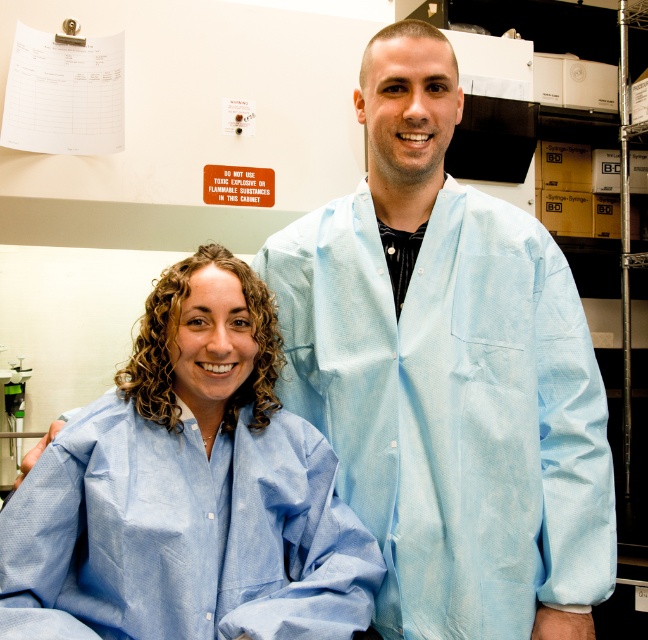
Question: Where is light blue fabric lab coat at center located in relation to light blue fabric at center in the image?

Choices:
 (A) right
 (B) left

Answer: (A)

Question: Can you confirm if light blue fabric lab coat at center is positioned above light blue fabric at center?

Choices:
 (A) no
 (B) yes

Answer: (B)

Question: Among these points, which one is nearest to the camera?

Choices:
 (A) (421, 506)
 (B) (152, 625)

Answer: (B)

Question: Which point is farther from the camera taking this photo?

Choices:
 (A) click(x=229, y=595)
 (B) click(x=550, y=321)

Answer: (B)

Question: Does light blue fabric lab coat at center have a greater width compared to light blue fabric at center?

Choices:
 (A) yes
 (B) no

Answer: (A)

Question: Which point is farther from the camera taking this photo?

Choices:
 (A) (428, 525)
 (B) (86, 605)

Answer: (A)